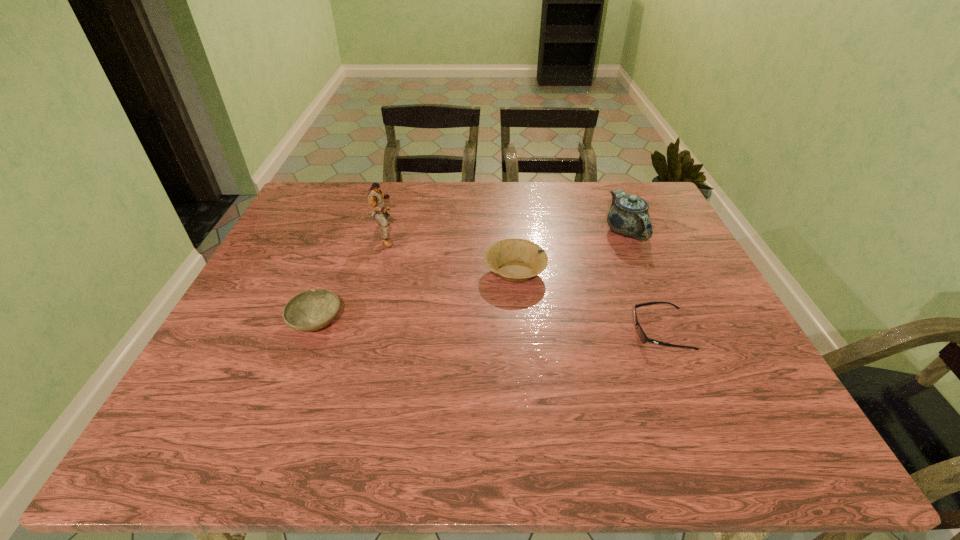
This screenshot has height=540, width=960. I want to click on free location at the far edge, so click(363, 184).

Where is `vacant space at the near edge`? The image size is (960, 540). vacant space at the near edge is located at coordinates click(x=446, y=418).

Identify the location of vacant space at the left edge of the desktop. The width and height of the screenshot is (960, 540). (233, 363).

The width and height of the screenshot is (960, 540). In the image, there is a desktop. What are the coordinates of `free region at the right edge` in the screenshot? It's located at (647, 245).

This screenshot has height=540, width=960. I want to click on free space at the far left corner of the desktop, so click(338, 210).

Image resolution: width=960 pixels, height=540 pixels. Identify the location of free spot at the far right corner of the desktop. [x=643, y=185].

Find the location of a particular element. This screenshot has width=960, height=540. vacant area between the fourth object from right to left and the third object from left to right is located at coordinates (450, 253).

Identify the location of free space that is in between the second tallest object and the puncher. The height and width of the screenshot is (540, 960). (506, 233).

This screenshot has width=960, height=540. I want to click on empty space that is in between the third object from right to left and the left bowl, so click(416, 296).

The image size is (960, 540). I want to click on vacant space in between the second tallest object and the sunglasses, so click(x=643, y=281).